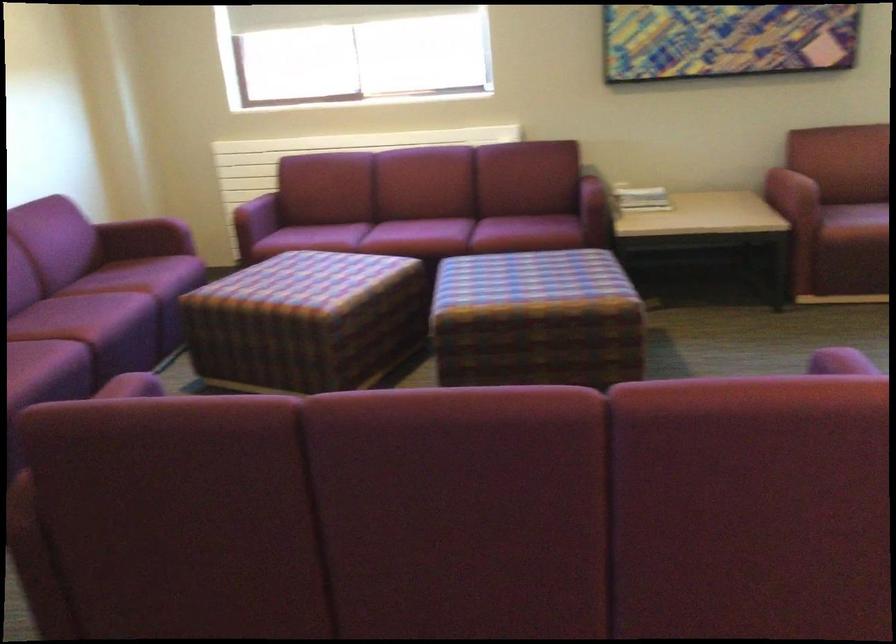
Identify the location of red sofa armrest. This screenshot has height=644, width=896. [x=242, y=198].